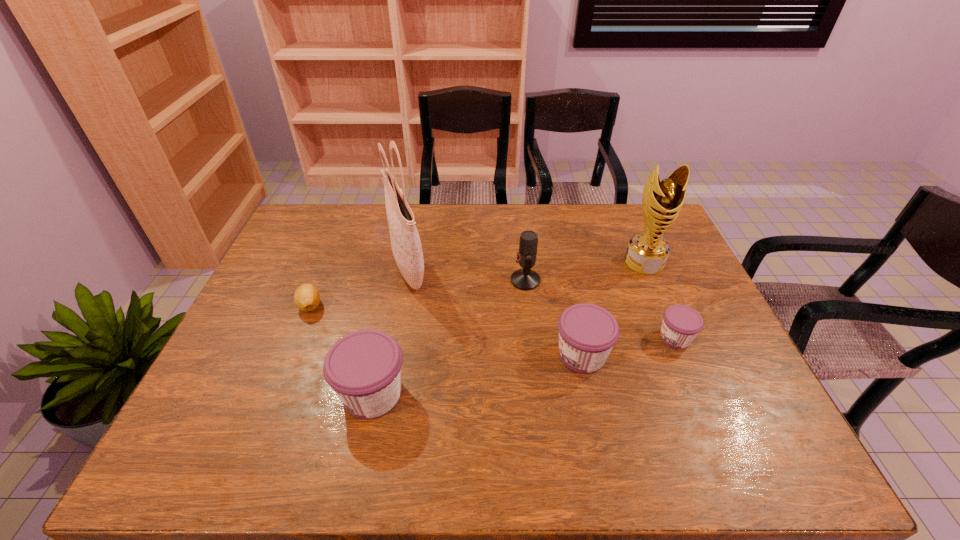
Locate an element on the screen. The image size is (960, 540). the tallest object is located at coordinates (406, 246).

I want to click on vacant space located on the front label of the leftmost jam, so click(x=261, y=394).

At what (x,y) coordinates should I click in order to perform the action: click on vacant point located 0.170m on the front label of the leftmost jam. Please return your answer as a coordinate pair (x, y). The width and height of the screenshot is (960, 540). Looking at the image, I should click on (266, 394).

This screenshot has width=960, height=540. Find the location of `free location located on the front label of the leftmost jam`. free location located on the front label of the leftmost jam is located at coordinates (274, 394).

At what (x,y) coordinates should I click in order to perform the action: click on vacant area situated on the front label of the second jam from left to right. Please return your answer as a coordinate pair (x, y). The image size is (960, 540). Looking at the image, I should click on (408, 355).

Find the location of a particular element. This screenshot has width=960, height=540. vacant area situated 0.270m on the front label of the second jam from left to right is located at coordinates (450, 355).

Where is `free region located on the front label of the second jam from left to right`? free region located on the front label of the second jam from left to right is located at coordinates (427, 355).

Identify the location of free space located on the front label of the shortest jam. (598, 338).

The image size is (960, 540). Identify the location of free space located on the front label of the shortest jam. (557, 338).

Find the location of a particular element. The width and height of the screenshot is (960, 540). vacant area situated 0.290m on the front label of the shortest jam is located at coordinates (550, 338).